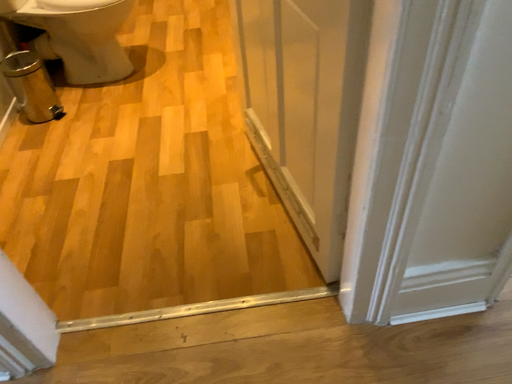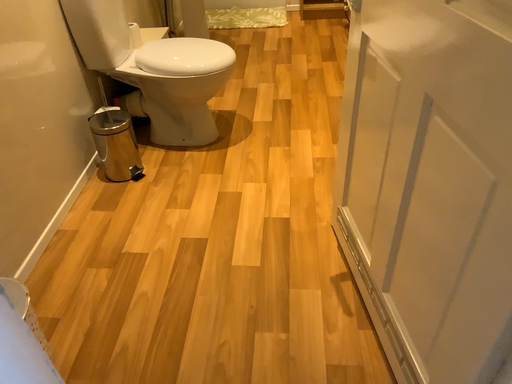
Question: How did the camera likely rotate when shooting the video?

Choices:
 (A) rotated right
 (B) rotated left

Answer: (B)